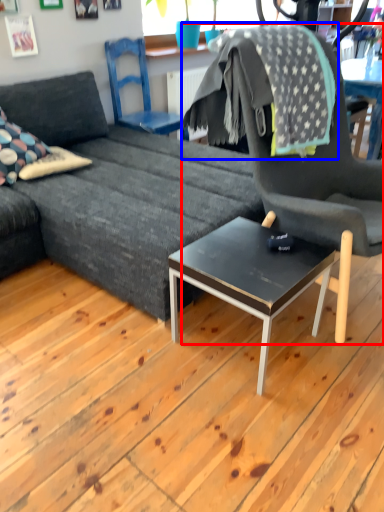
Question: Which of the following is the closest to the observer, chair (highlighted by a red box) or blanket (highlighted by a blue box)?

Choices:
 (A) chair
 (B) blanket

Answer: (A)